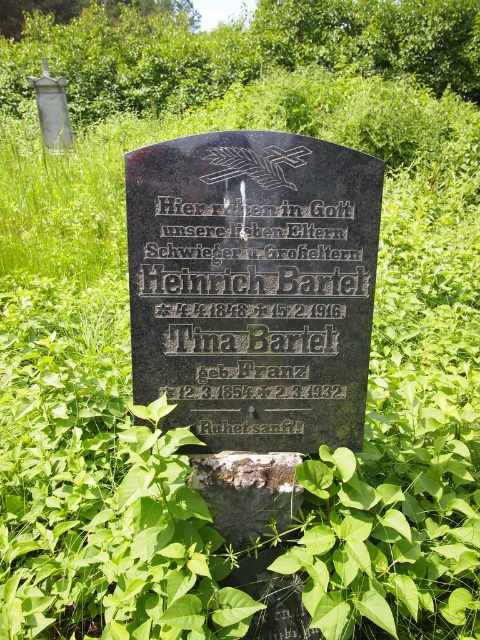
Question: Is black polished stone plaque at center thinner than rusty metal gravestone at center?

Choices:
 (A) no
 (B) yes

Answer: (A)

Question: Among these objects, which one is nearest to the camera?

Choices:
 (A) rusty metal gravestone at center
 (B) black polished stone plaque at center

Answer: (B)

Question: Among these objects, which one is farthest from the camera?

Choices:
 (A) black polished stone plaque at center
 (B) rusty metal gravestone at center

Answer: (B)

Question: Which of the following is the closest to the observer?

Choices:
 (A) rusty metal gravestone at center
 (B) black polished stone plaque at center

Answer: (B)

Question: Is black polished stone plaque at center smaller than rusty metal gravestone at center?

Choices:
 (A) no
 (B) yes

Answer: (A)

Question: Can you confirm if black polished stone plaque at center is positioned above rusty metal gravestone at center?

Choices:
 (A) no
 (B) yes

Answer: (B)